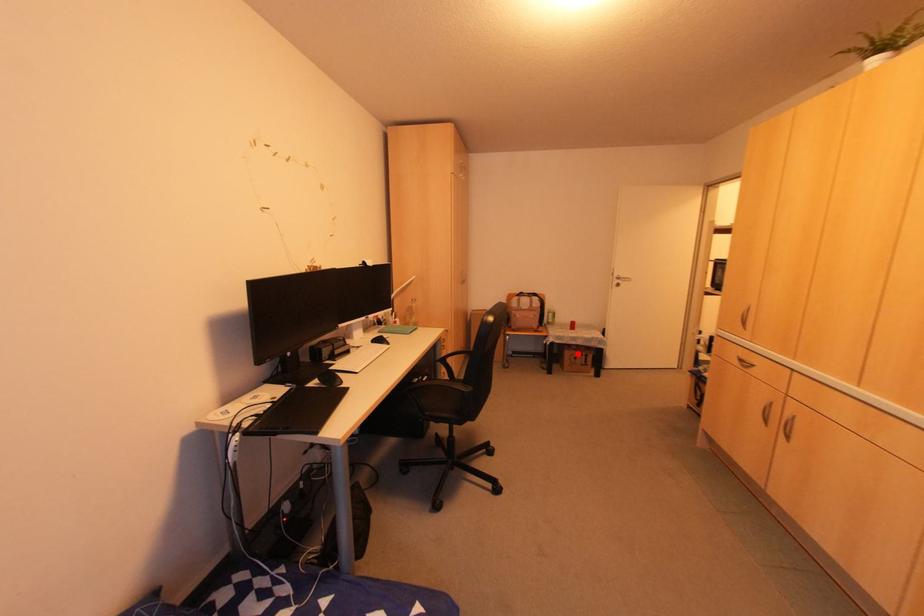
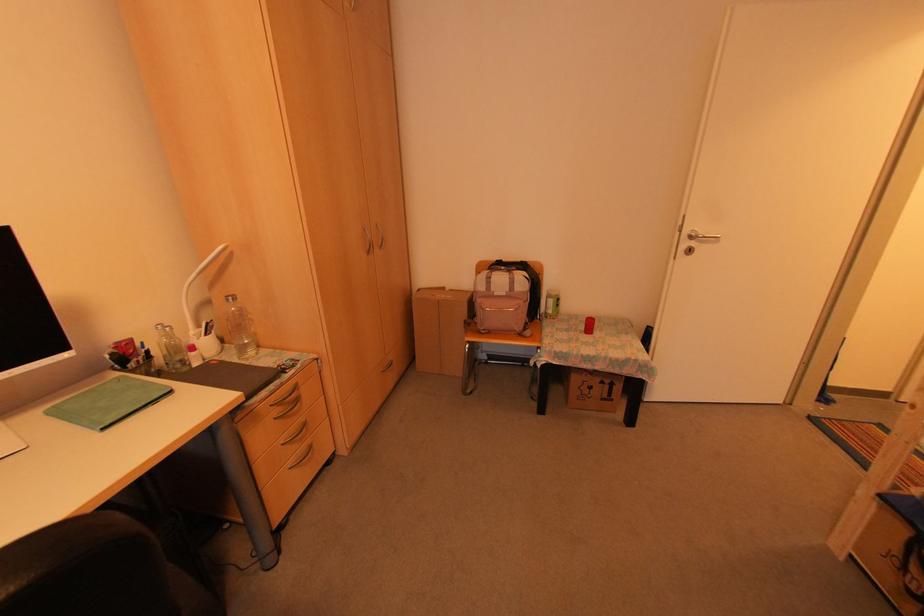
Where in the second image is the point corresponding to the highlighted location from the first image?

(598, 381)